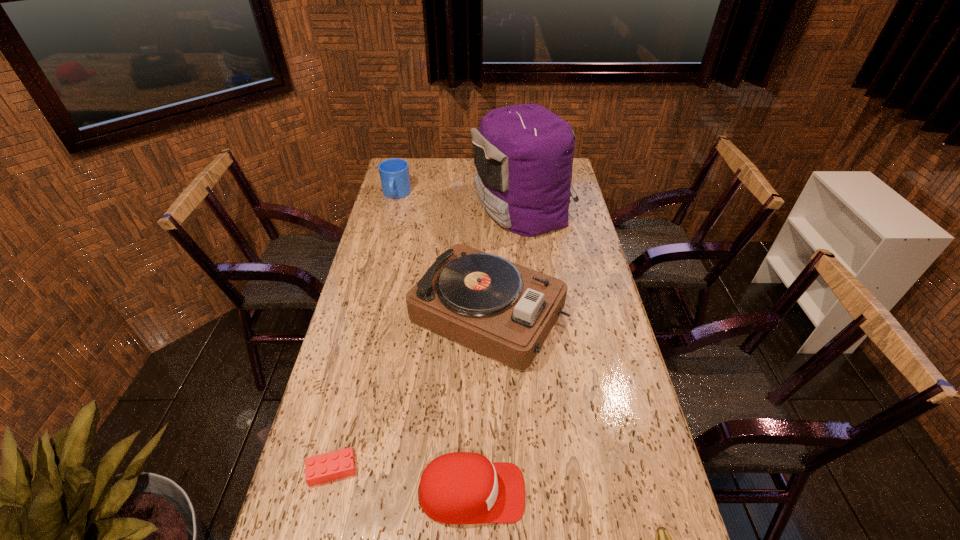
The width and height of the screenshot is (960, 540). What are the coordinates of `vacant space situated on the side of the mug with the handle` in the screenshot? It's located at (381, 256).

Locate an element on the screen. blank area located 0.220m on the front-facing side of the third shortest object is located at coordinates (618, 493).

Find the location of a particular element. The width and height of the screenshot is (960, 540). blank space located 0.370m on the right of the Lego is located at coordinates (508, 470).

At what (x,y) coordinates should I click in order to perform the action: click on object positioned at the far edge. Please return your answer as a coordinate pair (x, y). Looking at the image, I should click on (523, 154).

Find the location of a particular element. mug situated at the left edge is located at coordinates (394, 173).

Image resolution: width=960 pixels, height=540 pixels. In order to click on Lego that is at the left edge in this screenshot , I will do `click(339, 464)`.

At what (x,y) coordinates should I click in order to perform the action: click on backpack situated at the right edge. Please return your answer as a coordinate pair (x, y). This screenshot has height=540, width=960. Looking at the image, I should click on (523, 154).

Image resolution: width=960 pixels, height=540 pixels. Identify the location of record player that is at the right edge. (501, 309).

You are a GUI agent. You are given a task and a screenshot of the screen. Output one action in this format:
    pyautogui.click(x=<x>, y=<y>)
    Task: Click on the object that is at the far right corner
    The height and width of the screenshot is (540, 960).
    Given the screenshot: What is the action you would take?
    pyautogui.click(x=523, y=154)

In the image, there is a desktop. Find the location of `vacant space at the left edge`. vacant space at the left edge is located at coordinates (374, 251).